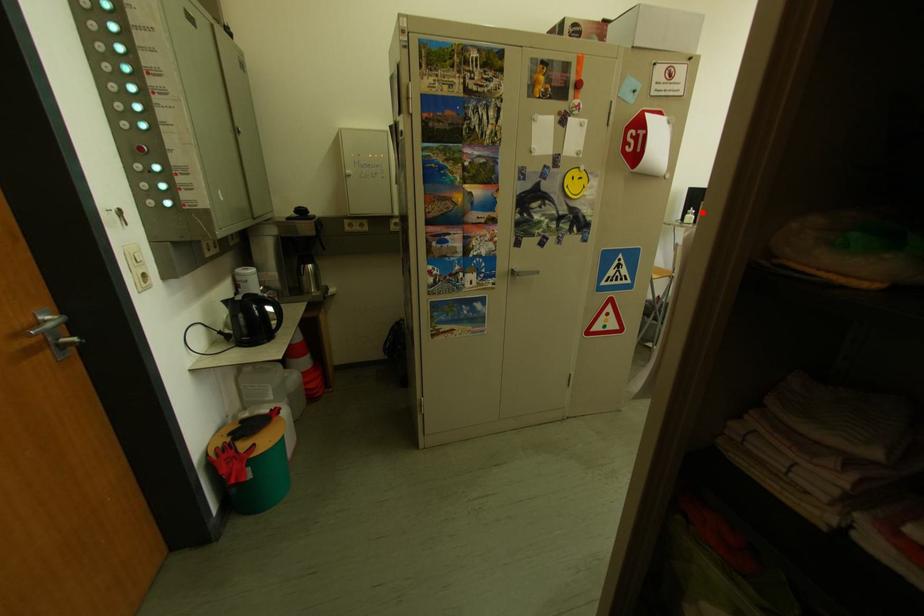
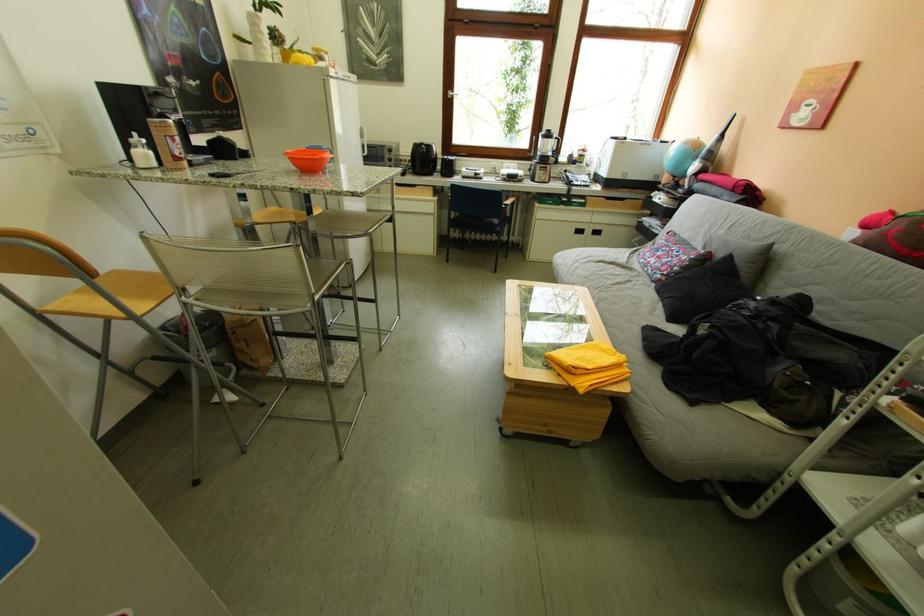
Where in the second image is the point corresponding to the highlighted location from the first image?

(144, 140)